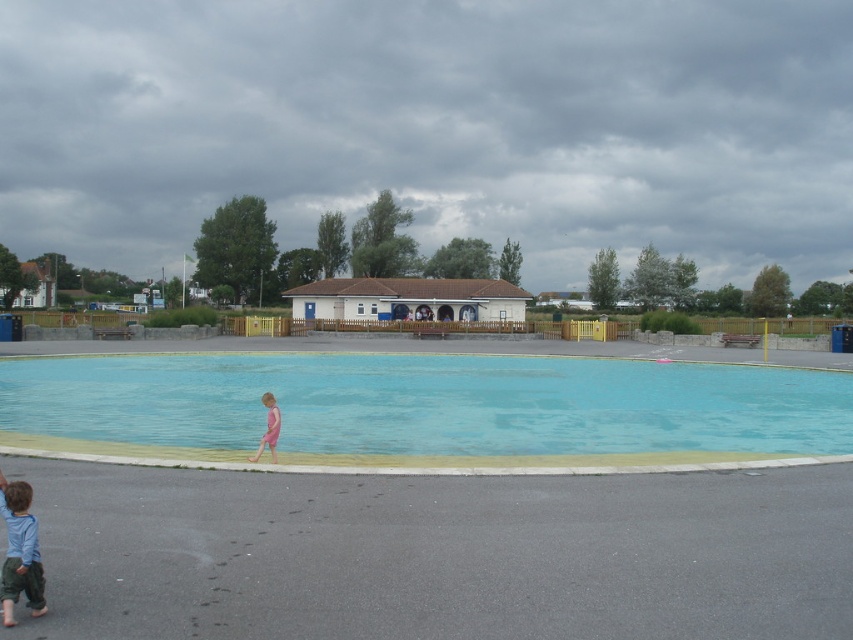
You are a lifeguard standing at the edge of the pool. You need to retrieve an item that fell into the water and another item that was left on the ground. The items are the blue smooth water at center and the blue cotton shirt at lower left. Which item is farther from your current position?

The blue smooth water at center and blue cotton shirt at lower left are 17.22 meters apart. Since you are at the edge of the pool, the blue cotton shirt at lower left is farther away because it is 17.22 meters away from the blue smooth water at center, which is in the center of the pool.

You are a lifeguard observing the pool area. You notice two children near the water. The first child is wearing a blue cotton shirt at lower left, and the second is in a pink matte swimsuit at lower center. Which child is wearing clothing that is narrower in width?

The blue cotton shirt at lower left is thinner than the pink matte swimsuit at lower center, so the child in the blue cotton shirt at lower left is wearing clothing that is narrower in width.